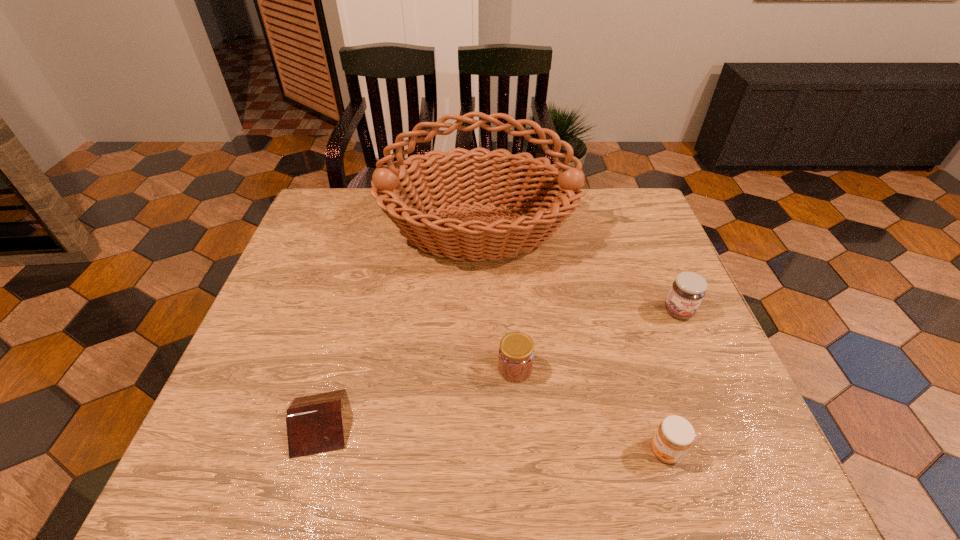
You are a GUI agent. You are given a task and a screenshot of the screen. Output one action in this format:
    pyautogui.click(x=<x>, y=<y>)
    Task: Click on the blank space located 0.080m on the front label of the rightmost object
    Image resolution: width=960 pixels, height=540 pixels.
    Given the screenshot: What is the action you would take?
    pyautogui.click(x=695, y=350)

Where is `blank space located on the back of the third nearest object`? Image resolution: width=960 pixels, height=540 pixels. blank space located on the back of the third nearest object is located at coordinates (511, 310).

Locate an element on the screen. Image resolution: width=960 pixels, height=540 pixels. vacant space located on the front label of the nearest jam is located at coordinates (507, 451).

Locate an element on the screen. The image size is (960, 540). free space located on the front label of the nearest jam is located at coordinates (623, 451).

At what (x,y) coordinates should I click in order to perform the action: click on free space located on the front label of the nearest jam. Please return your answer as a coordinate pair (x, y). Looking at the image, I should click on (602, 451).

Identify the location of vacant space located 0.320m on the right of the shortest object. (512, 422).

Where is `object that is at the far edge`? Image resolution: width=960 pixels, height=540 pixels. object that is at the far edge is located at coordinates (552, 199).

I want to click on jam located at the near edge, so click(674, 436).

Locate an element on the screen. The height and width of the screenshot is (540, 960). book at the near edge is located at coordinates (314, 423).

Where is `object situated at the left edge`? object situated at the left edge is located at coordinates (314, 423).